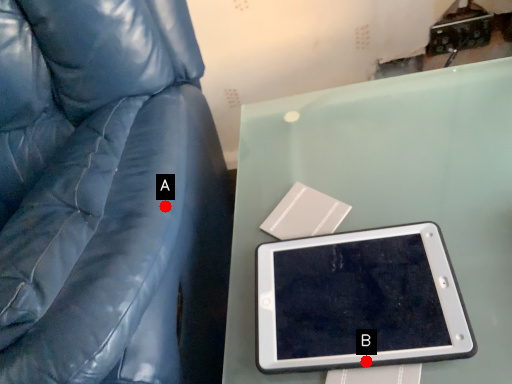
Question: Two points are circled on the image, labeled by A and B beside each circle. Which of the following is the farthest from the observer?

Choices:
 (A) A is further
 (B) B is further

Answer: (A)